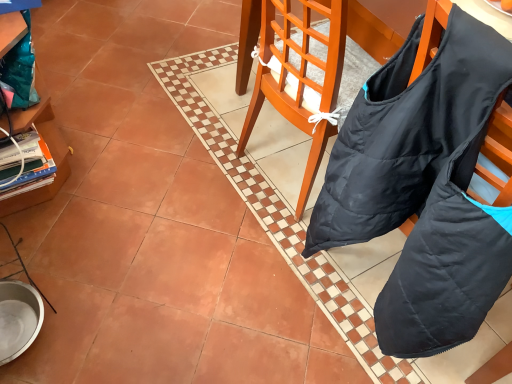
The image size is (512, 384). I want to click on black fabric bag at center, so click(295, 70).

Describe the element at coordinates (295, 70) in the screenshot. I see `black fabric bag at center` at that location.

The height and width of the screenshot is (384, 512). What do you see at coordinates (49, 149) in the screenshot? I see `wooden cabinet at left` at bounding box center [49, 149].

The image size is (512, 384). Find the location of `wooden cabinet at left`. wooden cabinet at left is located at coordinates (49, 149).

Where is `black fabric bag at center`? black fabric bag at center is located at coordinates (295, 70).

Considering the positions of objects black fabric bag at center and wooden cabinet at left in the image provided, who is more to the right, black fabric bag at center or wooden cabinet at left?

black fabric bag at center is more to the right.

Considering the positions of objects black fabric bag at center and wooden cabinet at left in the image provided, who is behind, black fabric bag at center or wooden cabinet at left?

wooden cabinet at left.

Is point (488, 377) farther from viewer compared to point (26, 205)?

That is False.

From the image's perspective, which is below, black fabric bag at center or wooden cabinet at left?

black fabric bag at center, from the image's perspective.

From a real-world perspective, who is located higher, black fabric bag at center or wooden cabinet at left?

black fabric bag at center, from a real-world perspective.

Can you confirm if black fabric bag at center is thinner than wooden cabinet at left?

In fact, black fabric bag at center might be wider than wooden cabinet at left.

Is black fabric bag at center shorter than wooden cabinet at left?

Incorrect, the height of black fabric bag at center does not fall short of that of wooden cabinet at left.

Who is smaller, black fabric bag at center or wooden cabinet at left?

black fabric bag at center.

Is black fabric bag at center situated inside wooden cabinet at left or outside?

black fabric bag at center is not inside wooden cabinet at left, it's outside.

Is black fabric bag at center not near wooden cabinet at left?

black fabric bag at center is actually quite close to wooden cabinet at left.

Could you tell me if black fabric bag at center is turned towards wooden cabinet at left?

No, black fabric bag at center is not turned towards wooden cabinet at left.

In the image, there is a black fabric bag at center. Identify the location of cabinetry below it (from a real-world perspective). This screenshot has height=384, width=512. (49, 149).

Consider the image. Is wooden cabinet at left to the left or to the right of black fabric bag at center in the image?

In the image, wooden cabinet at left appears on the left side of black fabric bag at center.

Does wooden cabinet at left come behind black fabric bag at center?

Yes, wooden cabinet at left is further from the viewer.

Between point (53, 154) and point (279, 81), which one is positioned in front?

Point (279, 81)

From the image's perspective, is wooden cabinet at left located beneath black fabric bag at center?

No.

From a real-world perspective, is wooden cabinet at left on black fabric bag at center?

No, from a real-world perspective, wooden cabinet at left is not over black fabric bag at center

Which object is wider, wooden cabinet at left or black fabric bag at center?

black fabric bag at center.

Considering the sizes of objects wooden cabinet at left and black fabric bag at center in the image provided, who is taller, wooden cabinet at left or black fabric bag at center?

Standing taller between the two is black fabric bag at center.

Considering the sizes of objects wooden cabinet at left and black fabric bag at center in the image provided, who is smaller, wooden cabinet at left or black fabric bag at center?

black fabric bag at center is smaller.

Would you say wooden cabinet at left is inside or outside black fabric bag at center?

wooden cabinet at left exists outside the volume of black fabric bag at center.

Is wooden cabinet at left next to black fabric bag at center?

No, wooden cabinet at left is not in contact with black fabric bag at center.

Is wooden cabinet at left turned away from black fabric bag at center?

That's not correct — wooden cabinet at left is not looking away from black fabric bag at center.

How many degrees apart are the facing directions of wooden cabinet at left and black fabric bag at center?

1.31 degrees separate the facing orientations of wooden cabinet at left and black fabric bag at center.

The width and height of the screenshot is (512, 384). Identify the location of chair below the wooden cabinet at left (from the image's perspective). (295, 70).

The image size is (512, 384). Find the location of `cabinetry to the left of black fabric bag at center`. cabinetry to the left of black fabric bag at center is located at coordinates (49, 149).

I want to click on chair located in front of the wooden cabinet at left, so click(x=295, y=70).